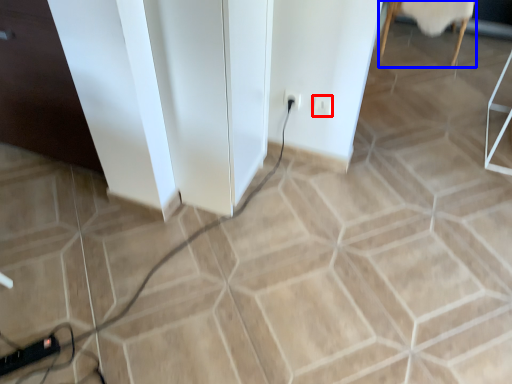
Question: Which point is further to the camera, socket (highlighted by a red box) or furniture (highlighted by a blue box)?

Choices:
 (A) socket
 (B) furniture

Answer: (B)